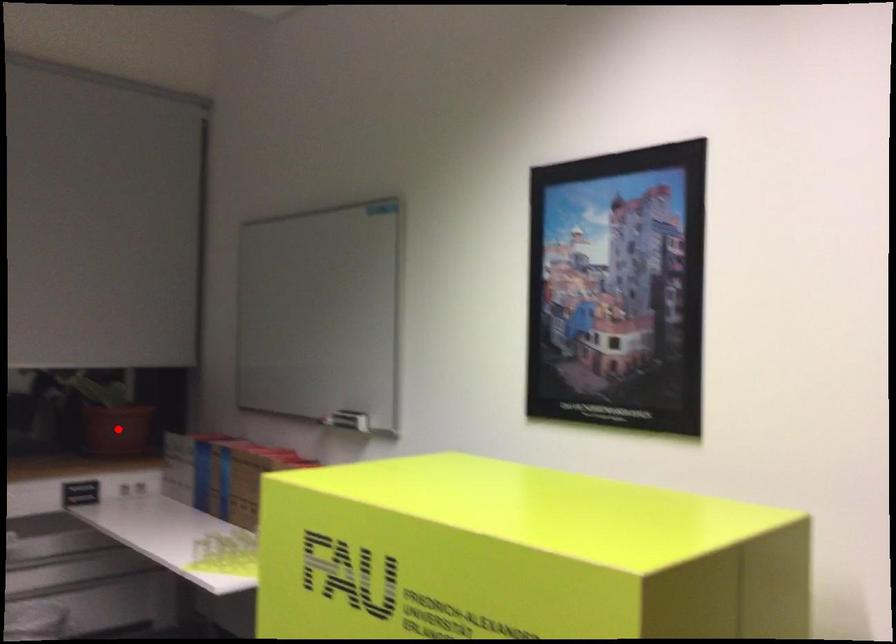
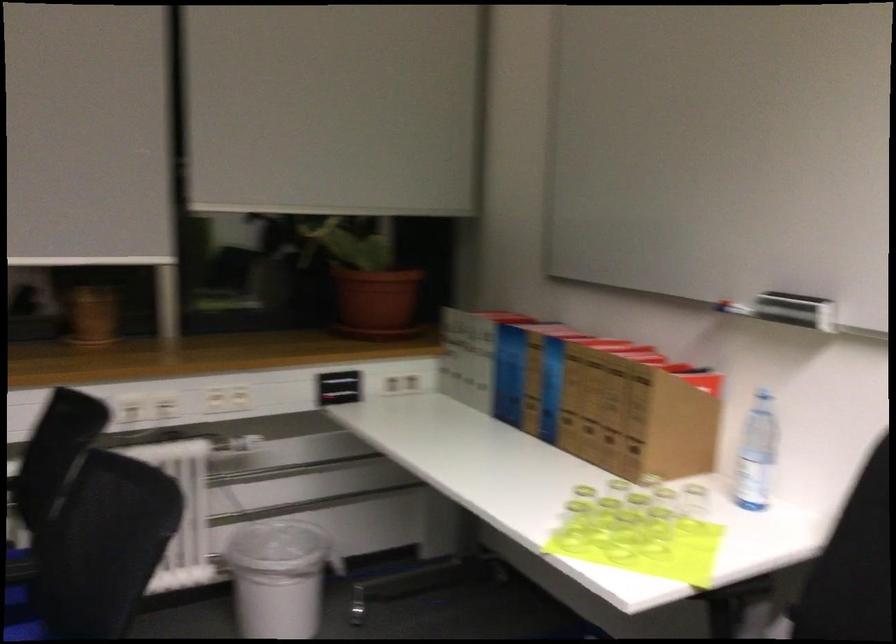
In the second image, find the point that corresponds to the highlighted location in the first image.

(375, 303)